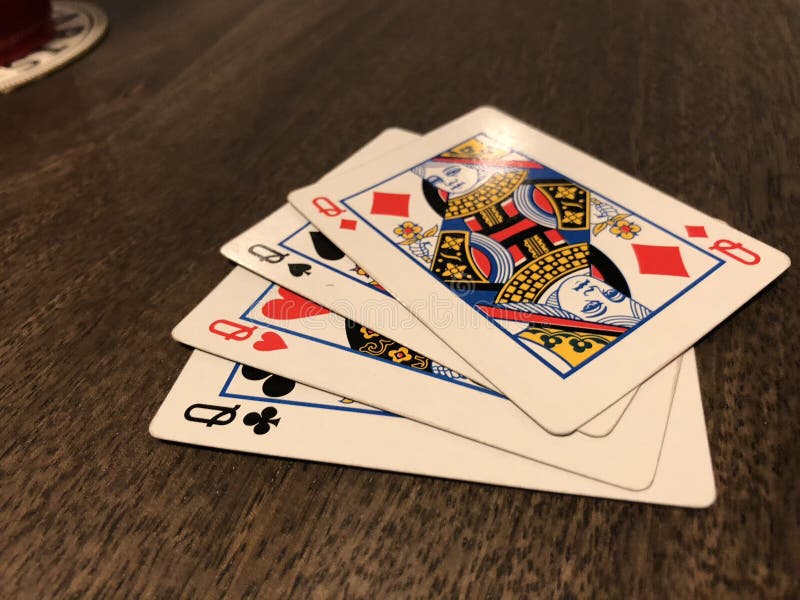
Where is `glass`? This screenshot has height=600, width=800. glass is located at coordinates (28, 28).